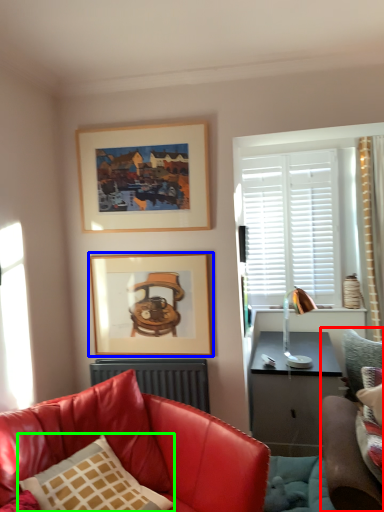
Question: Which is nearer to the studio couch (highlighted by a red box)? picture frame (highlighted by a blue box) or pillow (highlighted by a green box).

Choices:
 (A) picture frame
 (B) pillow

Answer: (B)